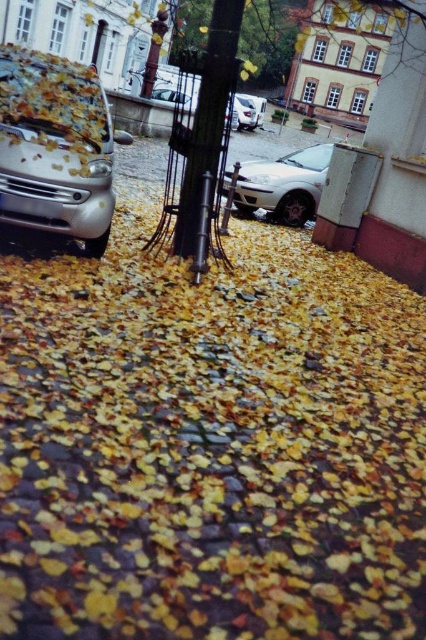
Question: Which of the following is the closest to the observer?

Choices:
 (A) silver metallic car at center
 (B) black metal pole at center
 (C) metallic pole at center
 (D) metallic silver sedan at center

Answer: (B)

Question: Which object appears closest to the camera in this image?

Choices:
 (A) black metal pole at center
 (B) silver metallic car at center

Answer: (A)

Question: Is black metal pole at center thinner than metallic silver sedan at center?

Choices:
 (A) no
 (B) yes

Answer: (B)

Question: Can you confirm if black metal pole at center is positioned above silver metallic car at center?

Choices:
 (A) yes
 (B) no

Answer: (B)

Question: Which point is farther to the camera?

Choices:
 (A) (63, 179)
 (B) (189, 225)

Answer: (B)

Question: Is white matte car at center to the left of metallic pole at center from the viewer's perspective?

Choices:
 (A) no
 (B) yes

Answer: (A)